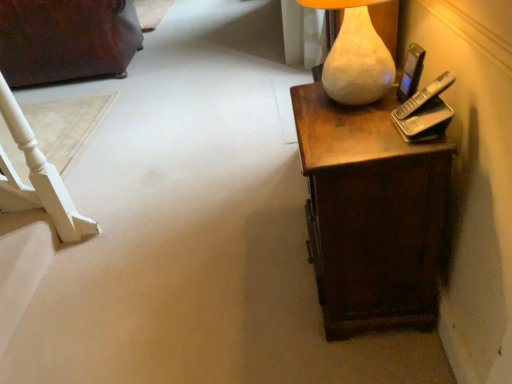
Locate an element on the screen. free point in front of matte white lamp at upper right is located at coordinates (358, 139).